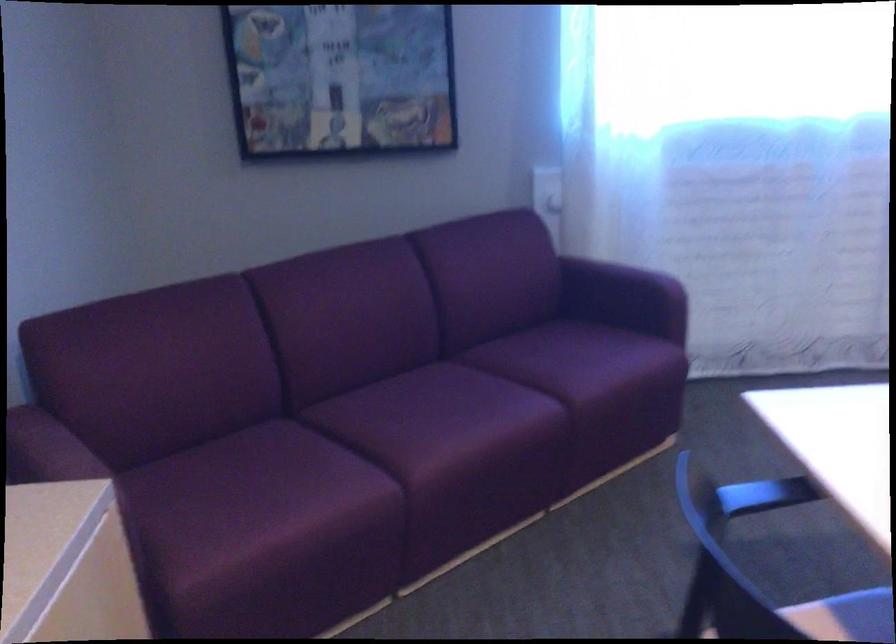
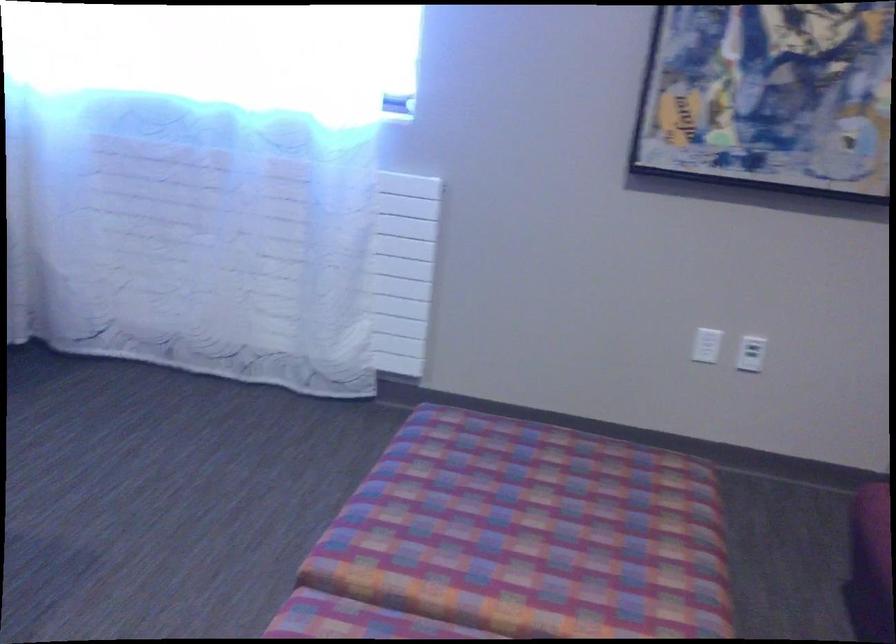
Question: Which direction would the cameraman need to move to produce the second image? Reply with the corresponding letter.

Choices:
 (A) Left
 (B) Right
 (C) Forward
 (D) Backward

Answer: (B)